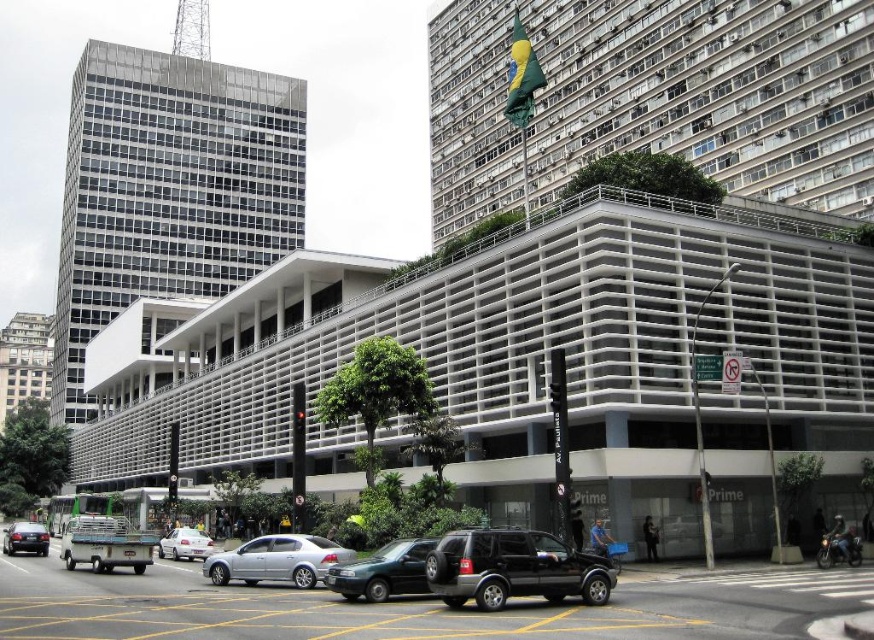
You are standing at the point marked by the coordinates point (512, 568) in the image. What object are you directly facing?

The point (512, 568) indicates black matte suv at center, so you are directly facing the black matte suv at center.

You are a pedestrian standing at the entrance of the Prime building. You see a black matte suv at center and a satin silver sedan at center. Which vehicle is closer to the entrance of the Prime building?

The satin silver sedan at center is closer to the entrance of the Prime building because the black matte suv at center is positioned to its right, meaning the sedan is between the entrance and the SUV.

Where is the black matte suv at center located in the image?

The black matte suv at center is located at point (x=512, y=568) in the image.